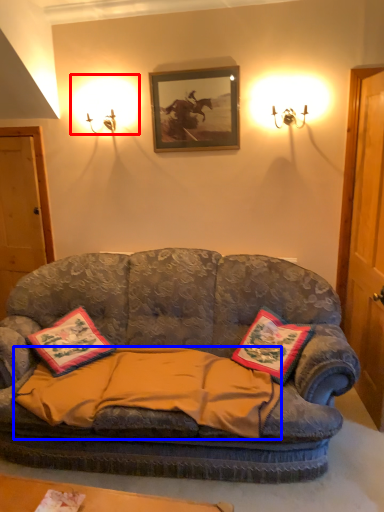
Question: Which object is further to the camera taking this photo, lighting (highlighted by a red box) or blanket (highlighted by a blue box)?

Choices:
 (A) lighting
 (B) blanket

Answer: (A)